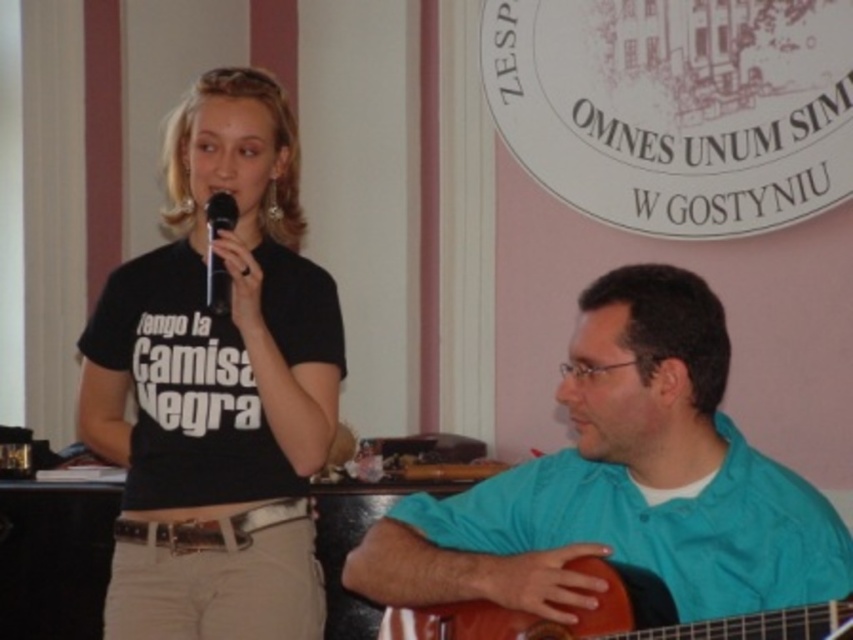
Question: Does black matte t-shirt at center have a larger size compared to brown wooden guitar at lower right?

Choices:
 (A) yes
 (B) no

Answer: (A)

Question: Which of the following is the closest to the observer?

Choices:
 (A) (659, 589)
 (B) (556, 605)
 (C) (312, 611)
 (D) (206, 262)

Answer: (A)

Question: Does black matte t-shirt at center appear on the right side of black plastic microphone at center?

Choices:
 (A) yes
 (B) no

Answer: (B)

Question: Which point is farther to the camera?

Choices:
 (A) (485, 609)
 (B) (579, 465)

Answer: (B)

Question: Estimate the real-world distances between objects in this image. Which object is farther from the black plastic microphone at center?

Choices:
 (A) brown wooden guitar at lower right
 (B) black matte t-shirt at center
 (C) teal matte shirt at right

Answer: (A)

Question: Observing the image, what is the correct spatial positioning of brown wooden guitar at lower right in reference to black plastic microphone at center?

Choices:
 (A) left
 (B) right

Answer: (B)